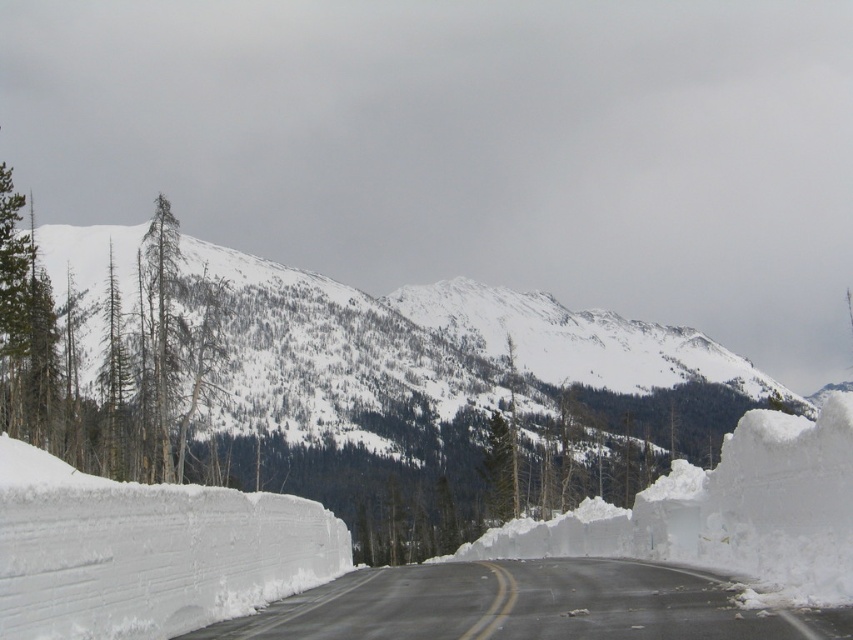
The width and height of the screenshot is (853, 640). Describe the element at coordinates (527, 605) in the screenshot. I see `black asphalt road at center` at that location.

Measure the distance between black asphalt road at center and camera.

A distance of 56.44 feet exists between black asphalt road at center and camera.

Is point (488, 616) positioned in front of point (158, 410)?

Yes, it is in front of point (158, 410).

Where is `black asphalt road at center`? The height and width of the screenshot is (640, 853). black asphalt road at center is located at coordinates (527, 605).

Based on the photo, who is positioned more to the left, white snow-covered mountain at upper center or green textured tree at upper left?

From the viewer's perspective, green textured tree at upper left appears more on the left side.

How far apart are white snow-covered mountain at upper center and green textured tree at upper left?

They are 104.99 meters apart.

This screenshot has height=640, width=853. Describe the element at coordinates (428, 352) in the screenshot. I see `white snow-covered mountain at upper center` at that location.

Identify the location of white snow-covered mountain at upper center. This screenshot has width=853, height=640. [x=428, y=352].

Between point (495, 353) and point (335, 614), which one is positioned behind?

Point (495, 353)

Between white snow-covered mountain at upper center and black asphalt road at center, which one is positioned lower?

Positioned lower is black asphalt road at center.

The width and height of the screenshot is (853, 640). Identify the location of white snow-covered mountain at upper center. (428, 352).